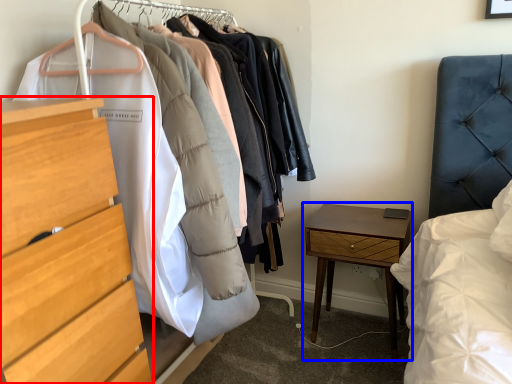
Question: Among these objects, which one is nearest to the camera, chest of drawers (highlighted by a red box) or nightstand (highlighted by a blue box)?

Choices:
 (A) chest of drawers
 (B) nightstand

Answer: (A)